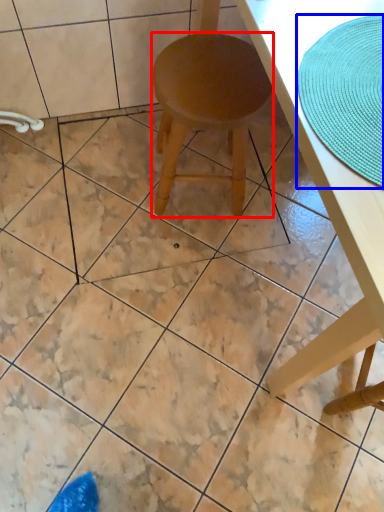
Question: Which object appears farthest to the camera in this image, stool (highlighted by a red box) or mat (highlighted by a blue box)?

Choices:
 (A) stool
 (B) mat

Answer: (A)